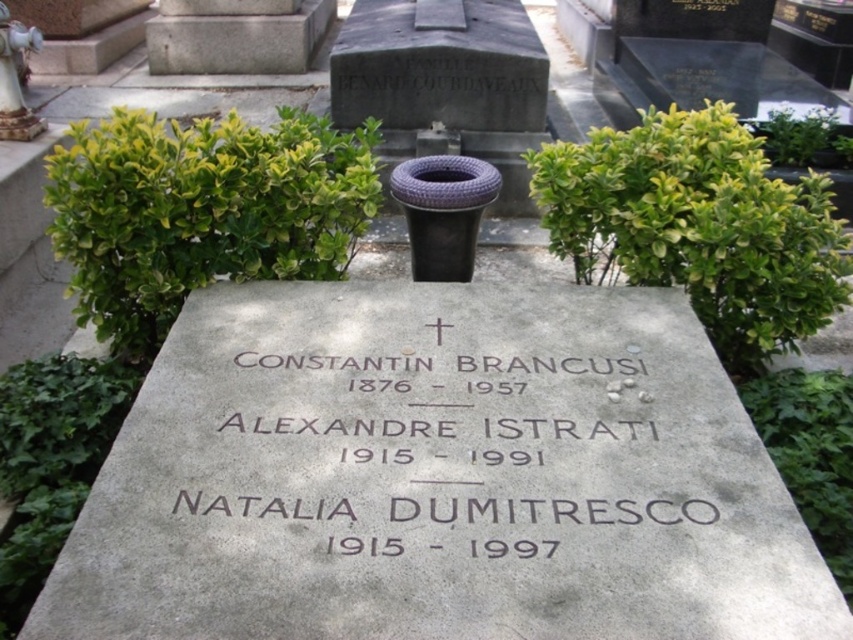
Between gray stone engraving at center and white ceramic statue at upper left, which one has less height?

gray stone engraving at center is shorter.

Image resolution: width=853 pixels, height=640 pixels. Describe the element at coordinates (445, 435) in the screenshot. I see `gray stone engraving at center` at that location.

The width and height of the screenshot is (853, 640). Identify the location of gray stone engraving at center. (445, 435).

Who is taller, gray stone at upper center or white ceramic statue at upper left?

→ gray stone at upper center

Where is `gray stone at upper center`? gray stone at upper center is located at coordinates (236, 35).

At what (x,y) coordinates should I click in order to perform the action: click on gray stone at upper center. Please return your answer as a coordinate pair (x, y). The width and height of the screenshot is (853, 640). Looking at the image, I should click on (236, 35).

Which is more to the right, gray stone engraving at center or gray stone at upper center?

From the viewer's perspective, gray stone engraving at center appears more on the right side.

What do you see at coordinates (445, 435) in the screenshot? I see `gray stone engraving at center` at bounding box center [445, 435].

This screenshot has width=853, height=640. I want to click on gray stone engraving at center, so click(445, 435).